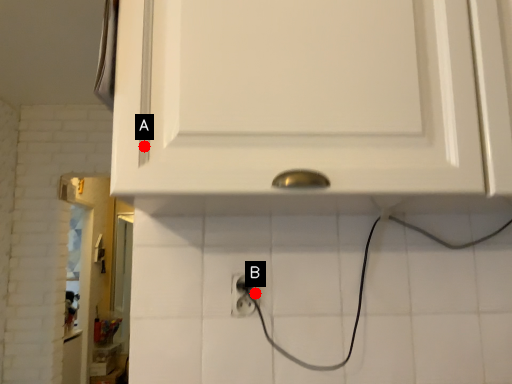
Question: Two points are circled on the image, labeled by A and B beside each circle. Among these points, which one is farthest from the camera?

Choices:
 (A) A is further
 (B) B is further

Answer: (B)